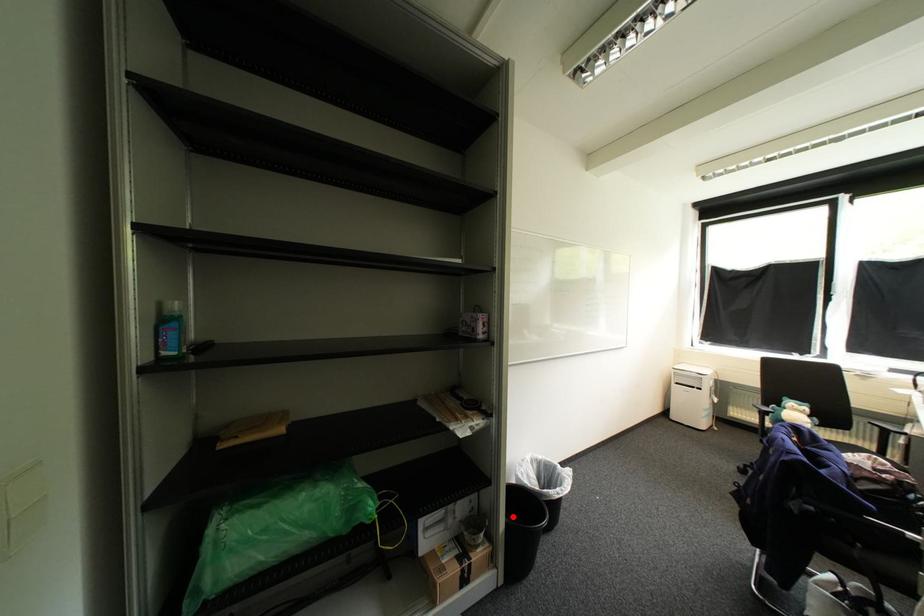
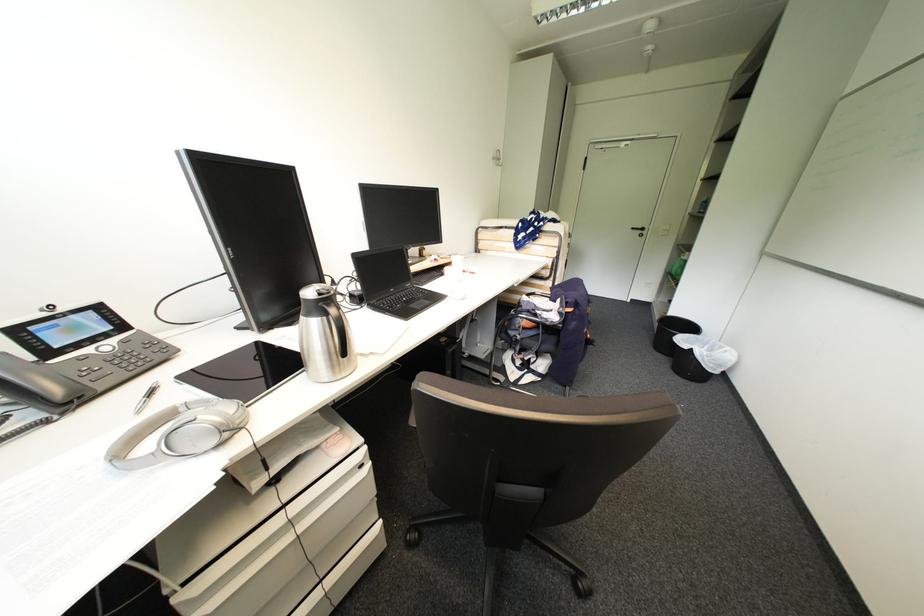
Locate, in the second image, the point that corresponds to the highlighted location in the first image.

(675, 313)